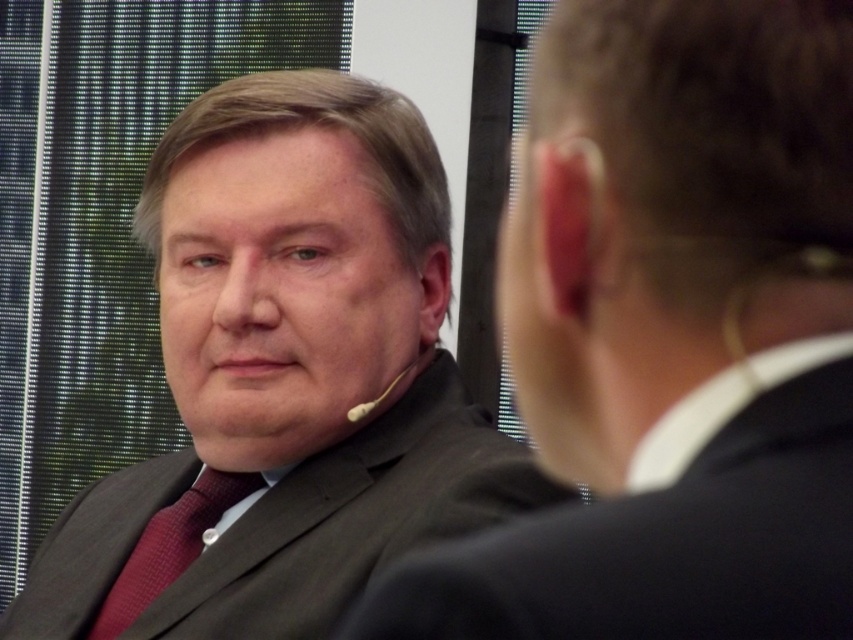
Which is below, dark gray suit at center or white plastic earbud at left?

dark gray suit at center

Who is positioned more to the right, dark gray suit at center or white plastic earbud at left?

dark gray suit at center is more to the right.

Who is more forward, [798,520] or [409,369]?

Point [798,520] is in front.

At what (x,y) coordinates should I click in order to perform the action: click on dark gray suit at center. Please return your answer as a coordinate pair (x, y). Looking at the image, I should click on (669, 529).

Who is more forward, (213, 93) or (381, 396)?

Point (381, 396) is in front.

The height and width of the screenshot is (640, 853). Identify the location of matte black suit at center. (283, 380).

Locate an element on the screen. matte black suit at center is located at coordinates (283, 380).

Who is taller, maroon textured tie at left or white plastic earbud at left?

maroon textured tie at left

Based on the photo, is the position of maroon textured tie at left more distant than that of white plastic earbud at left?

Yes, it is.

Measure the distance between point (212, 483) and camera.

4.12 feet

This screenshot has height=640, width=853. In order to click on maroon textured tie at left in this screenshot , I will do `click(169, 547)`.